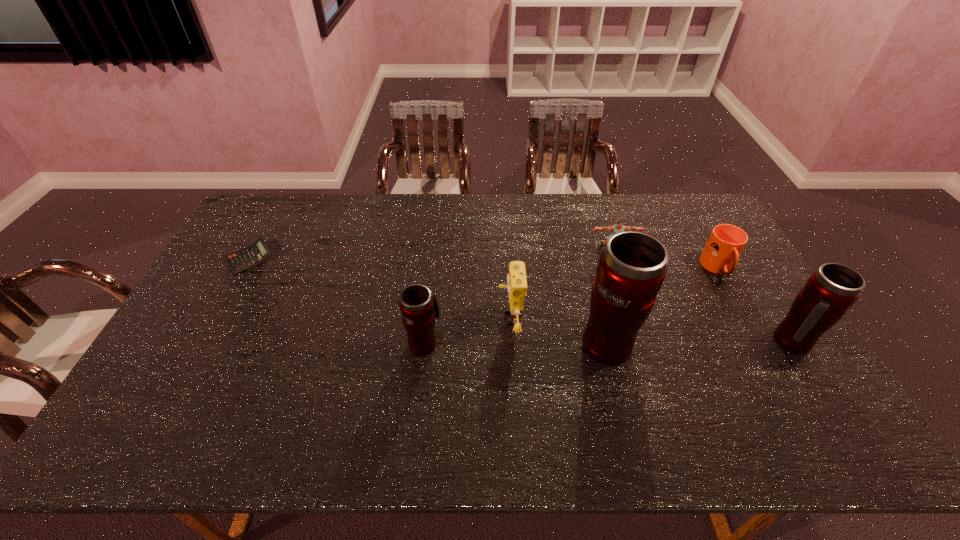
This screenshot has height=540, width=960. I want to click on vacant area at the right edge of the desktop, so click(736, 352).

I want to click on free spot at the near right corner of the desktop, so click(x=757, y=380).

Find the location of a particular element. free space between the third object from left to right and the puncher is located at coordinates (562, 285).

Find the location of a particular element. The image size is (960, 540). unoccupied position between the second object from left to right and the leftmost object is located at coordinates (337, 301).

Where is `blank region between the mug and the second tallest object`? This screenshot has height=540, width=960. blank region between the mug and the second tallest object is located at coordinates (756, 305).

The width and height of the screenshot is (960, 540). I want to click on vacant area that lies between the leftmost thermos bottle and the tallest object, so click(x=516, y=343).

Find the location of a particular element. free space between the leftmost object and the sponge is located at coordinates (380, 289).

I want to click on empty location between the tallest object and the sixth object from right to left, so click(516, 343).

Where is `vacant point located between the mug and the sixth shortest object`? vacant point located between the mug and the sixth shortest object is located at coordinates (756, 305).

You are a GUI agent. You are given a task and a screenshot of the screen. Output one action in this format:
    pyautogui.click(x=<x>, y=<y>)
    Task: Click on the free space between the second thermos bottle from left to right and the second tallest object
    
    Given the screenshot: What is the action you would take?
    pyautogui.click(x=700, y=342)